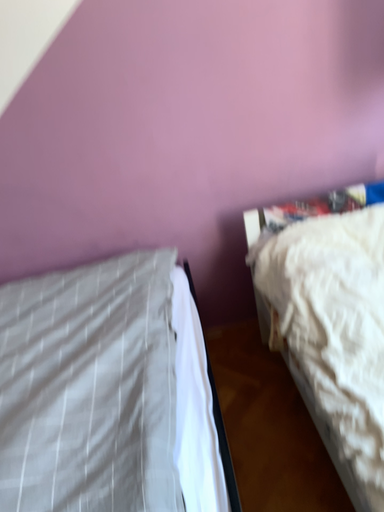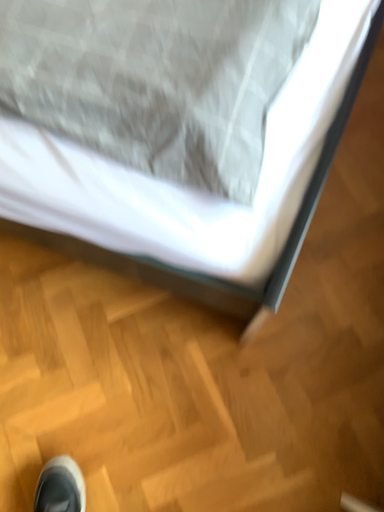
Question: How did the camera likely rotate when shooting the video?

Choices:
 (A) rotated downward
 (B) rotated upward

Answer: (A)